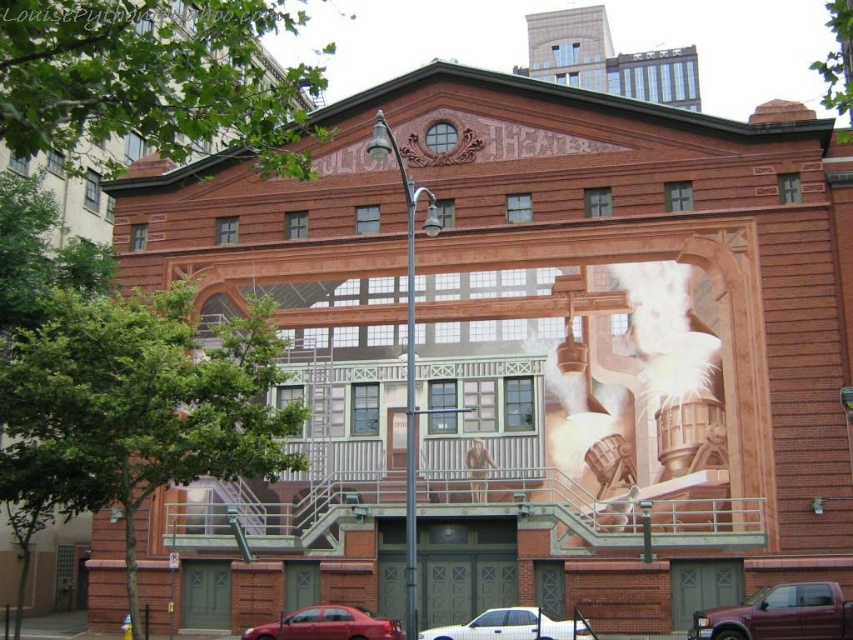
Question: Does metallic maroon pickup truck at lower right have a greater width compared to shiny red sedan at lower center?

Choices:
 (A) yes
 (B) no

Answer: (B)

Question: Is metallic maroon pickup truck at lower right bigger than shiny red sedan at lower center?

Choices:
 (A) no
 (B) yes

Answer: (A)

Question: Is metallic maroon pickup truck at lower right smaller than white glossy car at lower center?

Choices:
 (A) no
 (B) yes

Answer: (B)

Question: Among these points, which one is nearest to the camera?

Choices:
 (A) (308, 616)
 (B) (734, 632)

Answer: (B)

Question: Which of the following is the farthest from the observer?

Choices:
 (A) white glossy car at lower center
 (B) shiny red sedan at lower center
 (C) metallic maroon pickup truck at lower right

Answer: (B)

Question: Among these points, which one is farthest from the camera?

Choices:
 (A) (294, 621)
 (B) (764, 586)
 (C) (505, 625)

Answer: (A)